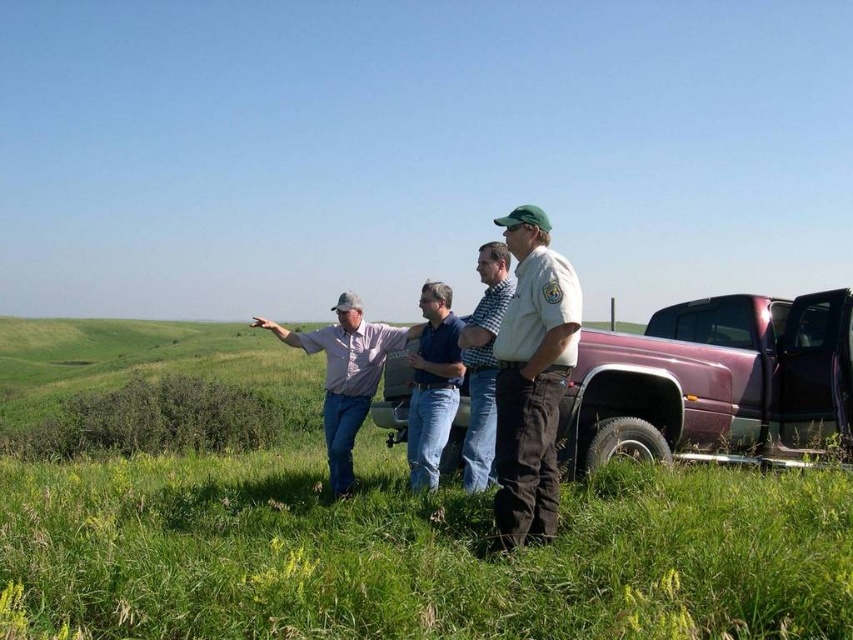
You are standing in the grassy field and want to walk to the truck. The truck is at the edge of the field. If you start walking from the green grassy at lower center, in which direction should you walk to reach the truck?

The green grassy at lower center is located at point (422, 554). Since the truck is at the edge of the field, you should walk towards the direction away from the center of the field to reach the truck.

You are a photographer trying to capture a group photo of the light brown shirt at center and checkered shirt at center. Since you want to ensure both are visible in the frame, which one should you focus on first to avoid blurring the background?

You should focus on the checkered shirt at center first because it is behind the light brown shirt at center, so focusing on the background subject ensures both are in focus when using a shallow depth of field.